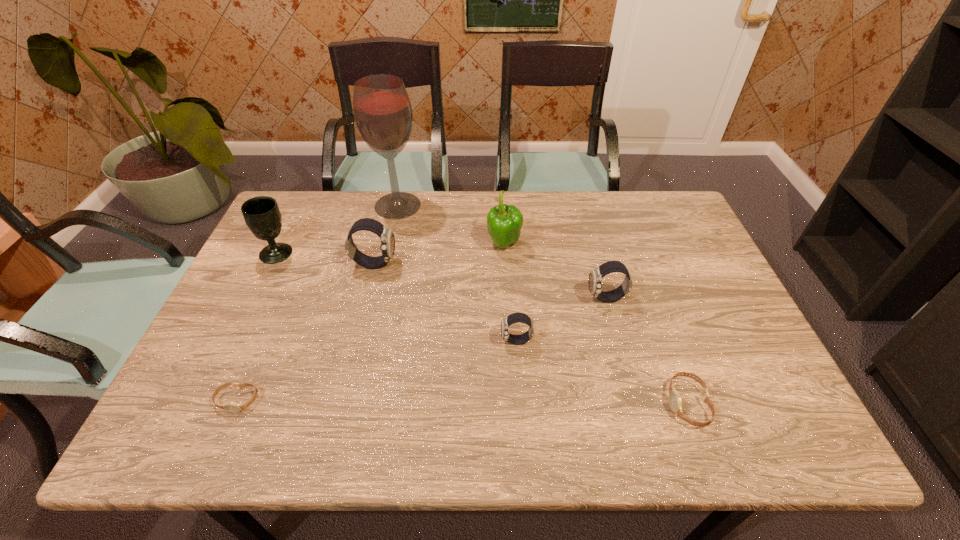
Locate an element on the screen. This screenshot has width=960, height=540. alcohol is located at coordinates (383, 114).

The height and width of the screenshot is (540, 960). I want to click on red alcohol, so click(x=383, y=114).

Identify the location of chalice. (261, 214).

I want to click on bell pepper, so click(x=504, y=223).

At what (x,y) coordinates should I click in order to perform the action: click on the tallest watch. Please return your answer as a coordinate pair (x, y). The width and height of the screenshot is (960, 540). Looking at the image, I should click on (387, 240).

The width and height of the screenshot is (960, 540). Identify the location of the fifth shortest object. (387, 240).

You are a GUI agent. You are given a task and a screenshot of the screen. Output one action in this format:
    pyautogui.click(x=<x>, y=<y>)
    Task: Click on the fourth shortest object
    The width and height of the screenshot is (960, 540).
    Given the screenshot: What is the action you would take?
    pyautogui.click(x=596, y=275)

Where is `the rightmost dark watch`? the rightmost dark watch is located at coordinates (596, 275).

You are a GUI agent. You are given a task and a screenshot of the screen. Output one action in this format:
    pyautogui.click(x=<x>, y=<y>)
    Task: Click on the sixth farthest object
    
    Given the screenshot: What is the action you would take?
    pyautogui.click(x=513, y=318)

Identify the location of the third watch from right to left. (513, 318).